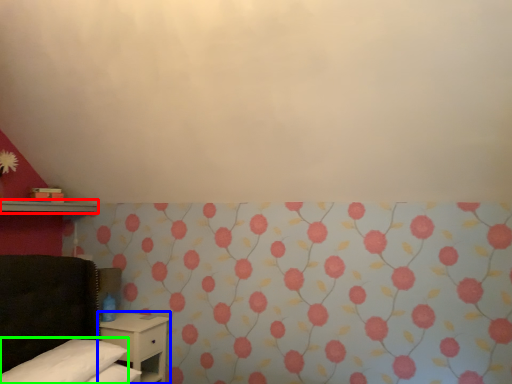
Question: Considering the real-world distances, which object is closest to shelf (highlighted by a red box)? nightstand (highlighted by a blue box) or pillow (highlighted by a green box).

Choices:
 (A) nightstand
 (B) pillow

Answer: (A)